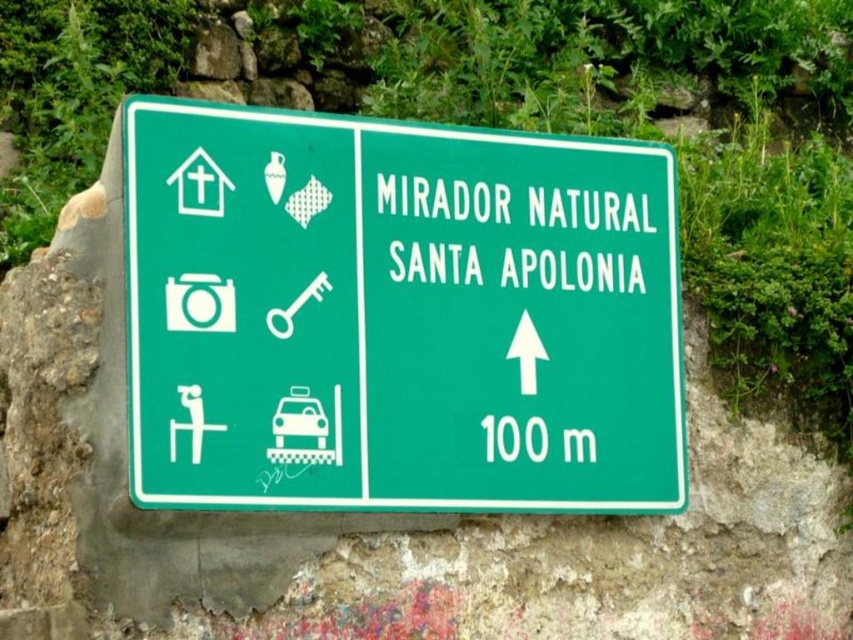
You are a tourist holding a matte white taxi at center in your hand and looking at the green matte sign at center. Which object is taller?

The green matte sign at center is taller than the matte white taxi at center.

You are a hiker trying to locate the green matte sign at center. Based on the scene description, where should you look to find it?

The green matte sign at center is located at the point with coordinates 0.492 on the x axis and 0.469 on the y axis.

You are standing at the point marked as point (410, 321) on the road sign. You want to walk to the Mirador Natural Santa Apolonia. According to the sign, which direction should you go?

The text on the right side of the sign reads Mirador Natural Santa Apolonia with an upward pointing arrow below it. Since you are at point (410, 321), which is 46.60 meters away from the viewer, you should follow the direction indicated by the upward arrow on the sign towards Mirador Natural Santa Apolonia.